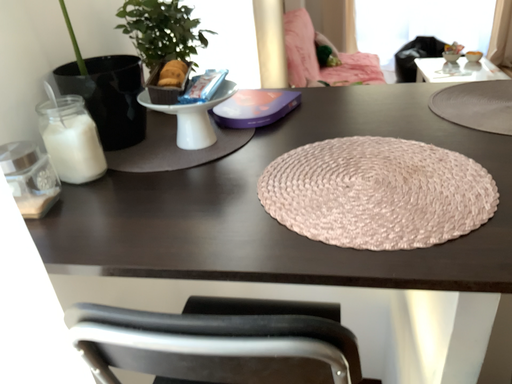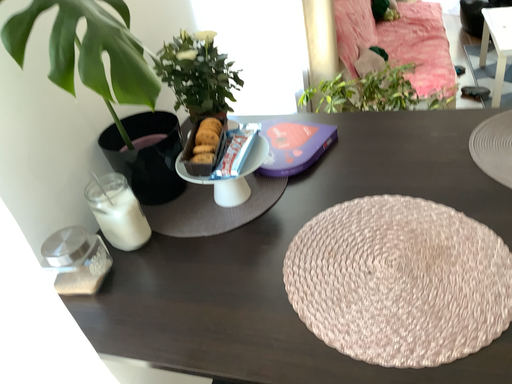
Question: Which way did the camera rotate in the video?

Choices:
 (A) rotated right
 (B) rotated left

Answer: (B)